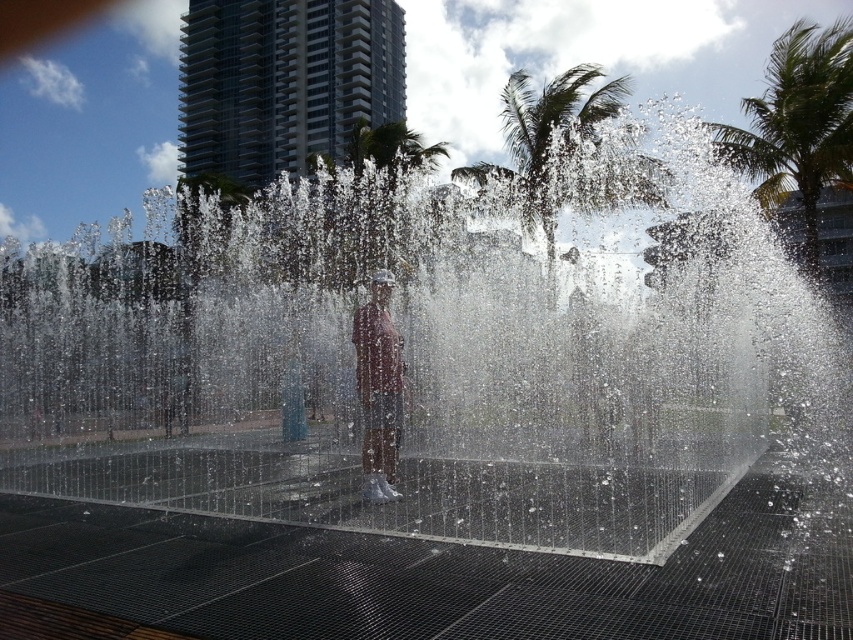
Can you confirm if green leafy palm tree at upper right is positioned below matte pink shirt at center?

No, green leafy palm tree at upper right is not below matte pink shirt at center.

Can you confirm if green leafy palm tree at upper right is positioned above matte pink shirt at center?

Yes, green leafy palm tree at upper right is above matte pink shirt at center.

At what (x,y) coordinates should I click in order to perform the action: click on green leafy palm tree at upper right. Please return your answer as a coordinate pair (x, y). The image size is (853, 640). Looking at the image, I should click on (798, 124).

I want to click on green leafy palm tree at upper right, so click(798, 124).

Can you confirm if green leafy palm tree at upper center is smaller than matte pink shirt at center?

No.

Is green leafy palm tree at upper center above matte pink shirt at center?

Correct, green leafy palm tree at upper center is located above matte pink shirt at center.

Where is `green leafy palm tree at upper center`? The width and height of the screenshot is (853, 640). green leafy palm tree at upper center is located at coordinates (550, 136).

Can you confirm if green leafy palm tree at upper right is wider than green leafy palm tree at upper center?

Yes.

Is green leafy palm tree at upper right positioned behind green leafy palm tree at upper center?

Yes, it is behind green leafy palm tree at upper center.

What do you see at coordinates (798, 124) in the screenshot? I see `green leafy palm tree at upper right` at bounding box center [798, 124].

Find the location of a particular element. green leafy palm tree at upper right is located at coordinates (798, 124).